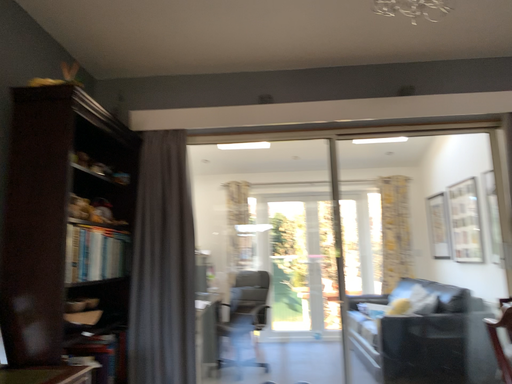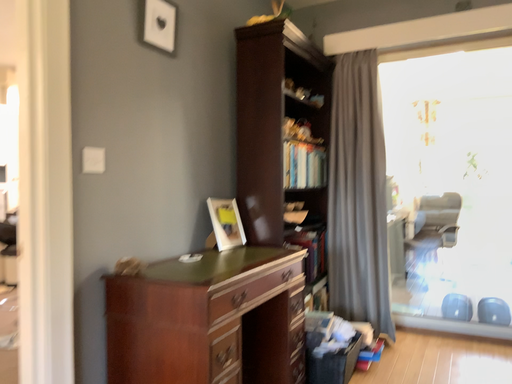
Question: Which way did the camera rotate in the video?

Choices:
 (A) rotated upward
 (B) rotated downward

Answer: (B)